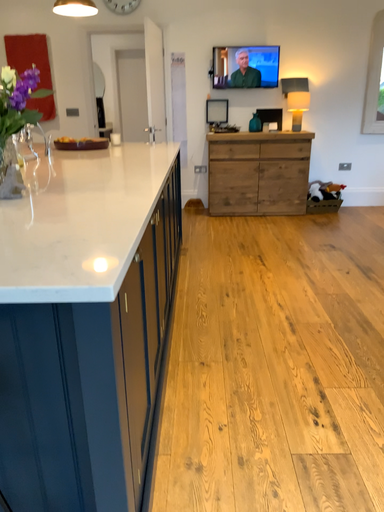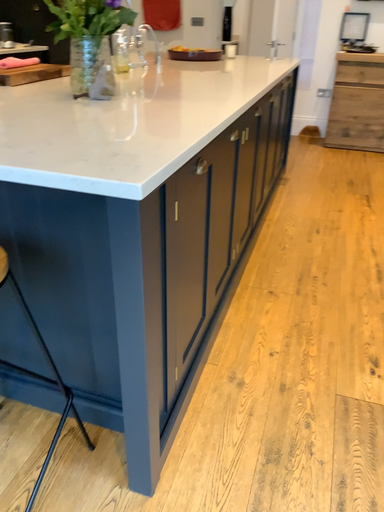
Question: Which way did the camera rotate in the video?

Choices:
 (A) rotated downward
 (B) rotated upward

Answer: (A)